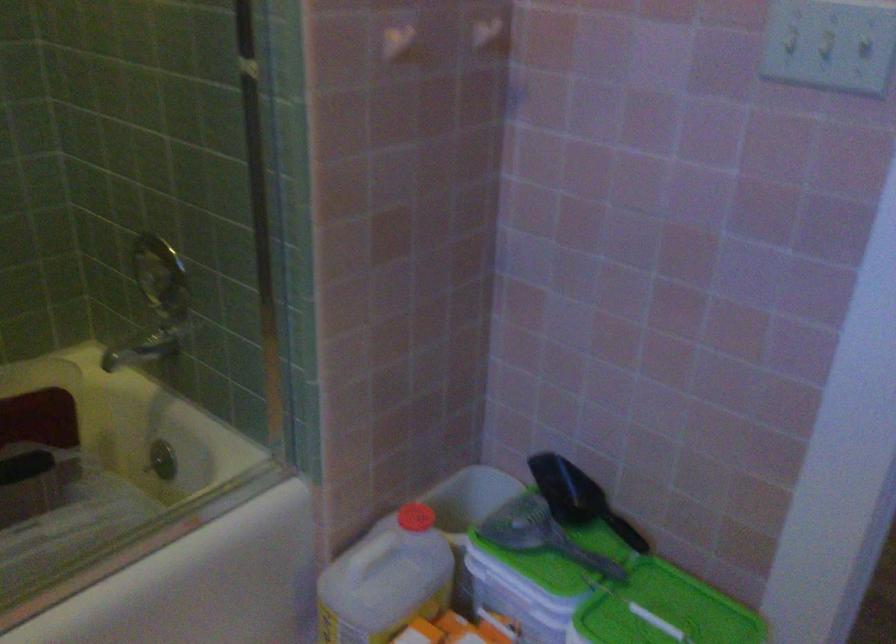
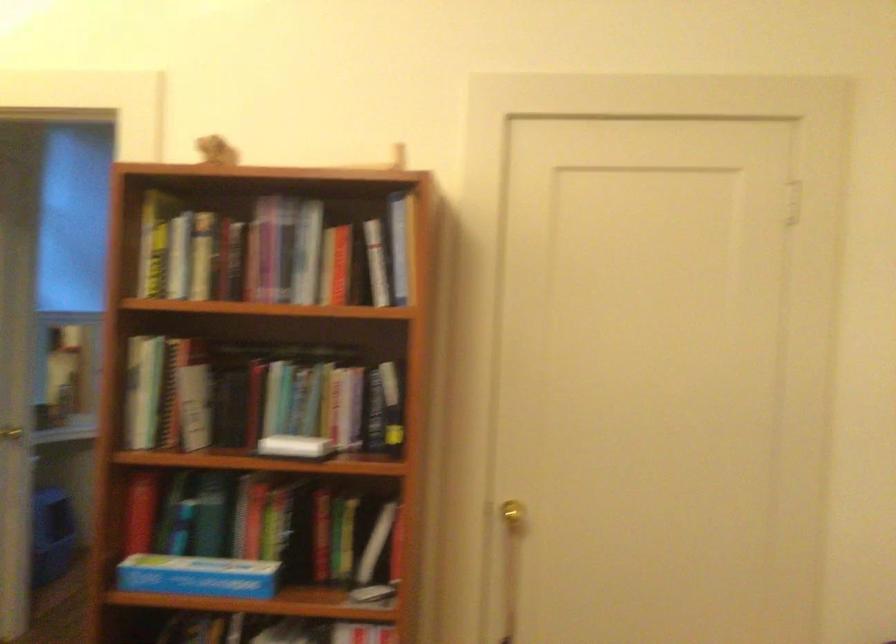
Question: I am providing you with two images of the same scene from different viewpoints. Which of the following objects are not visible in image2?

Choices:
 (A) microwave control dial
 (B) light switch
 (C) blue cardboard box
 (D) book

Answer: (B)